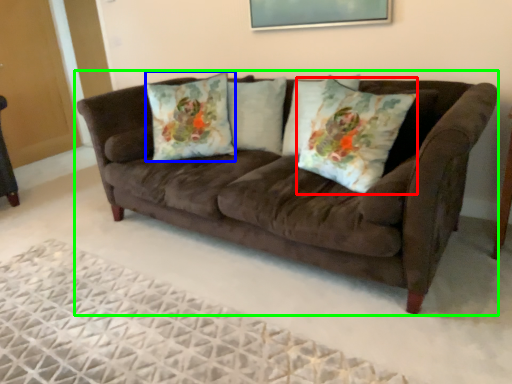
Question: Estimate the real-world distances between objects in this image. Which object is farther from throw pillow (highlighted by a red box), throw pillow (highlighted by a blue box) or studio couch (highlighted by a green box)?

Choices:
 (A) throw pillow
 (B) studio couch

Answer: (A)